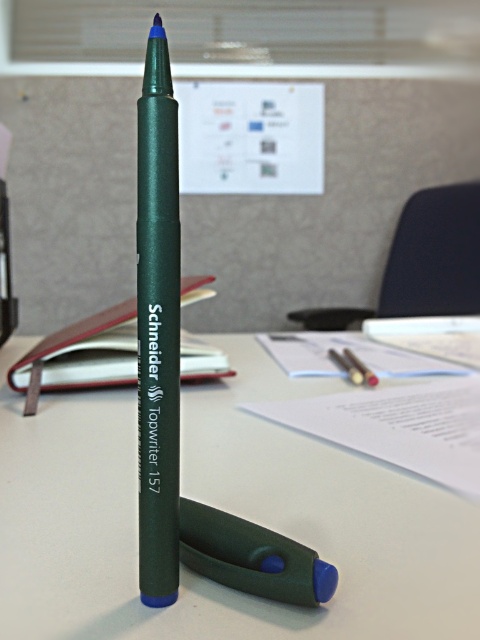
Question: Is white matte table at center wider than green rubberized pen at center?

Choices:
 (A) yes
 (B) no

Answer: (A)

Question: Which of the following is the farthest from the observer?

Choices:
 (A) (143, 509)
 (B) (228, 531)
 (C) (262, 502)

Answer: (C)

Question: Which point is closer to the camera?

Choices:
 (A) green rubberized pen at center
 (B) green matte marker at center
 (C) white matte table at center

Answer: (C)

Question: Does white matte table at center appear over green matte marker at center?

Choices:
 (A) yes
 (B) no

Answer: (B)

Question: Which of the following is the closest to the observer?

Choices:
 (A) green rubberized pen at center
 (B) green matte marker at center

Answer: (B)

Question: Is the position of green matte marker at center more distant than that of green rubberized pen at center?

Choices:
 (A) no
 (B) yes

Answer: (A)